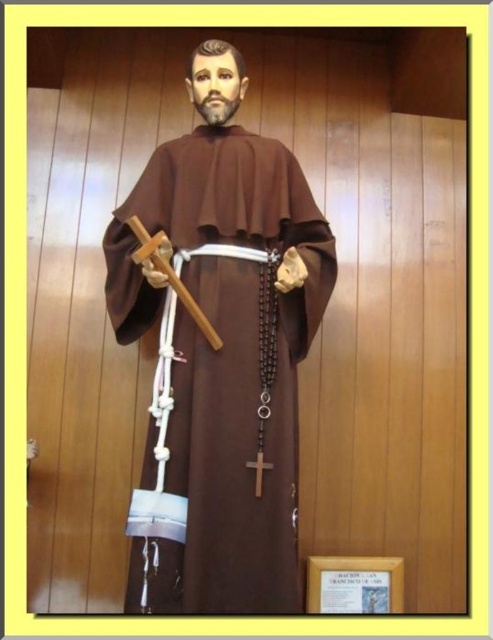
Question: Can you confirm if brown matte robe at center is smaller than wooden cross at center?

Choices:
 (A) yes
 (B) no

Answer: (B)

Question: Can you confirm if brown matte robe at center is positioned to the left of wooden cross at center?

Choices:
 (A) yes
 (B) no

Answer: (A)

Question: Is brown matte robe at center bigger than wooden cross at center?

Choices:
 (A) no
 (B) yes

Answer: (B)

Question: Which object is closer to the camera taking this photo?

Choices:
 (A) brown matte robe at center
 (B) wooden cross at center

Answer: (A)